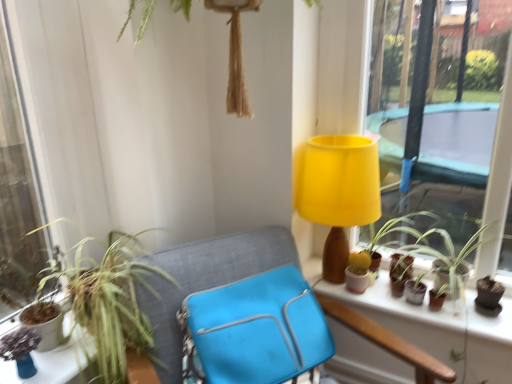
Image resolution: width=512 pixels, height=384 pixels. I want to click on empty space that is ontop of matte green plant at lower left (from a real-world perspective), so click(54, 352).